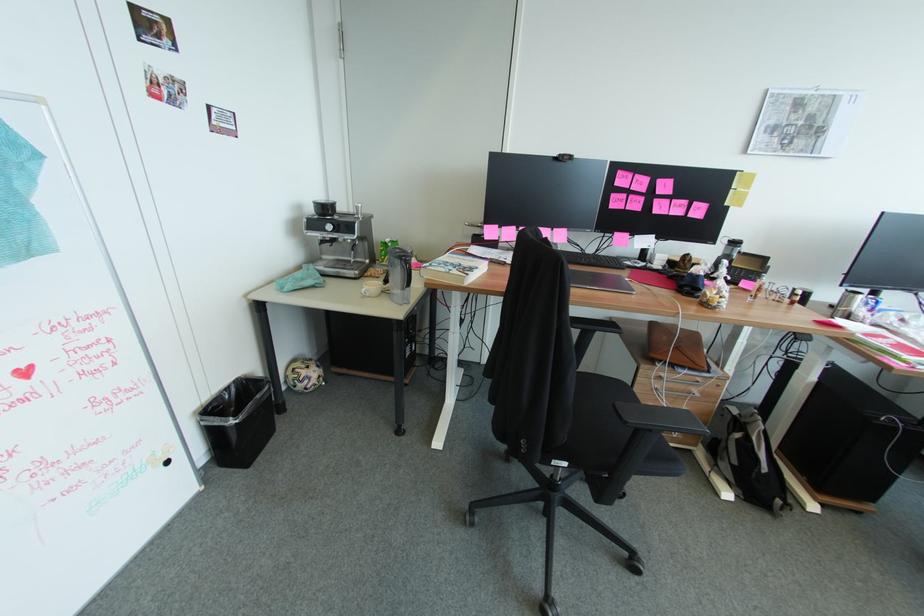
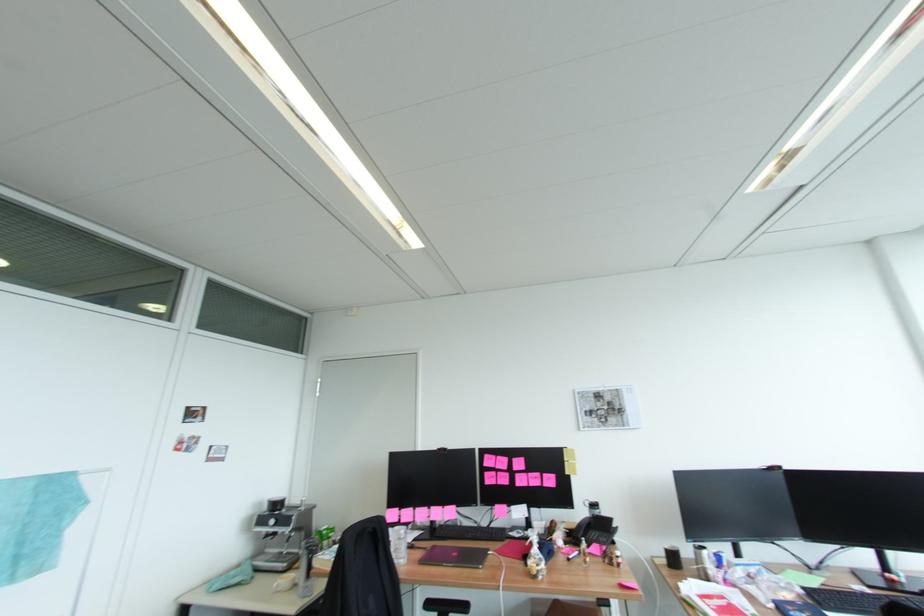
In the second image, find the point that corresponds to the point at 319,225 in the first image.

(266, 520)